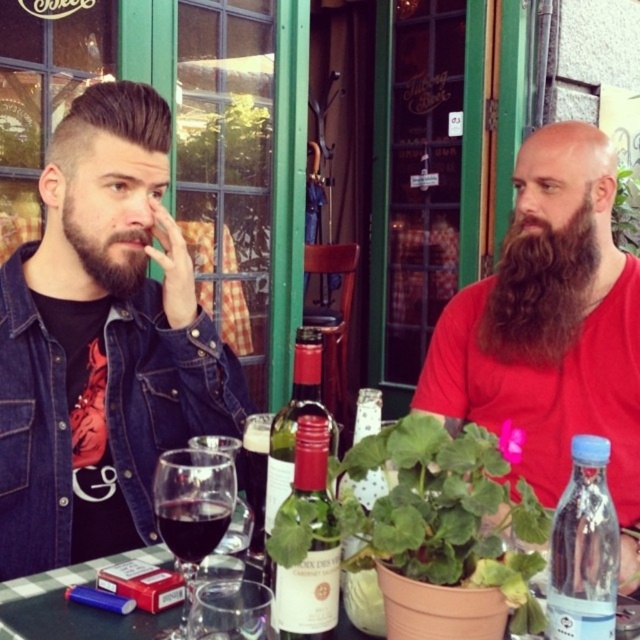
Question: From the image, what is the correct spatial relationship of matte glass wine bottle at center in relation to dark red glass at center?

Choices:
 (A) below
 (B) above

Answer: (B)

Question: Which is nearer to the matte glass wine bottle at center?

Choices:
 (A) dark brown thick beard at left
 (B) brushed denim jacket at lower left

Answer: (B)

Question: Is brown matte beard at center wider than dark brown thick beard at left?

Choices:
 (A) no
 (B) yes

Answer: (B)

Question: Among these objects, which one is farthest from the camera?

Choices:
 (A) brushed denim jacket at lower left
 (B) brown curly beard at right
 (C) white matte bottle at center

Answer: (B)

Question: Among these points, which one is nearest to the camera?

Choices:
 (A) (556, 547)
 (B) (312, 369)

Answer: (A)

Question: Is brown matte beard at center to the right of white matte wine bottle at center from the viewer's perspective?

Choices:
 (A) no
 (B) yes

Answer: (B)